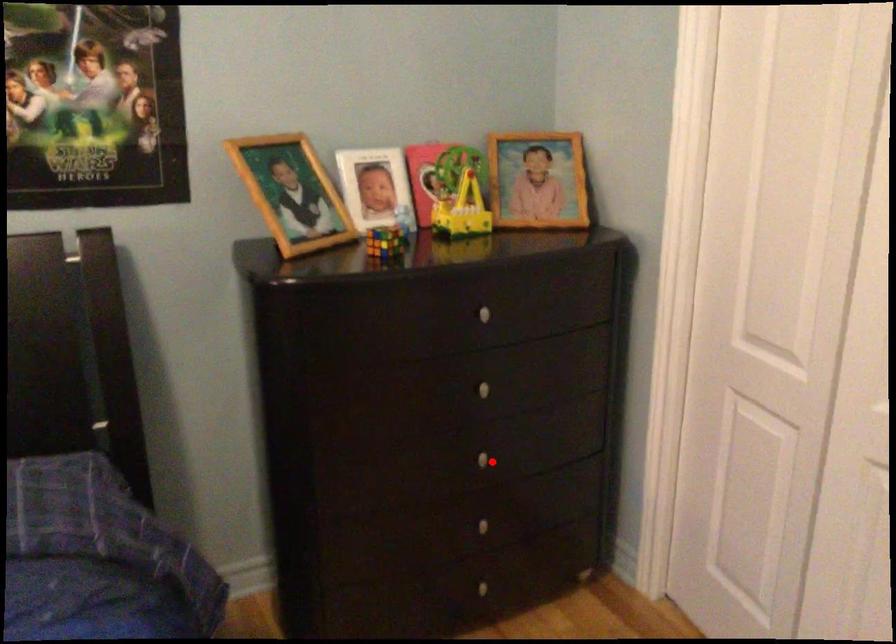
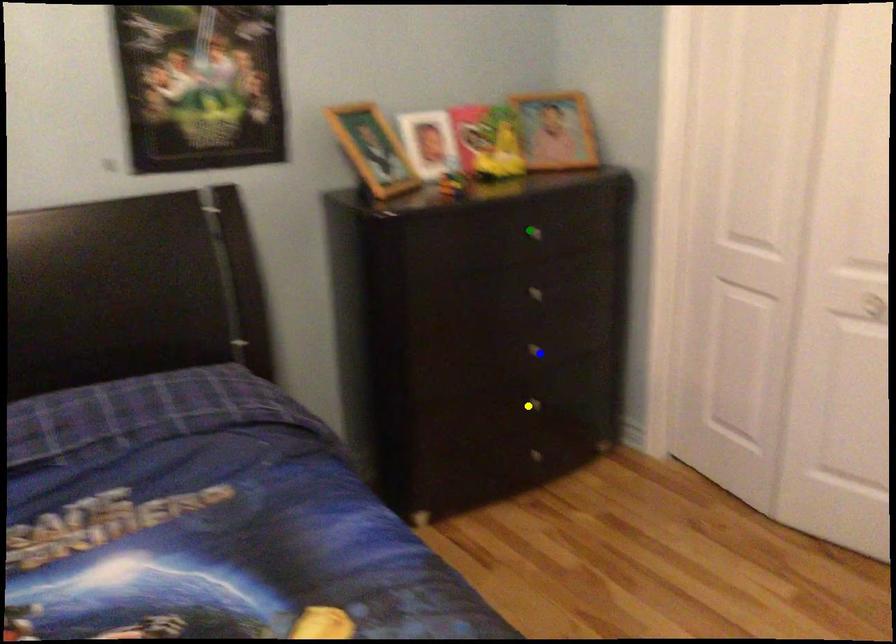
Question: I am providing you with two images of the same scene from different viewpoints. A red point is marked on the first image. You are given multiple points on the second image. Which mark in image 2 goes with the point in image 1?

Choices:
 (A) blue point
 (B) green point
 (C) yellow point

Answer: (A)